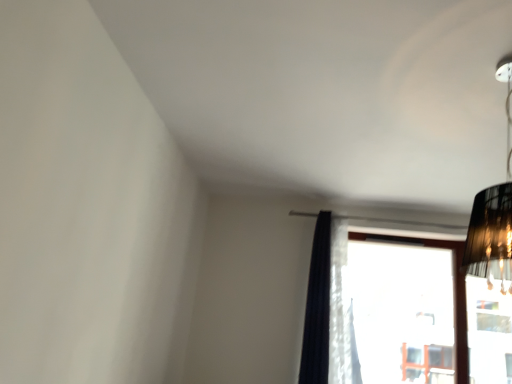
Question: In terms of width, does black fabric lampshade at upper right look wider or thinner when compared to transparent glass window at center?

Choices:
 (A) wide
 (B) thin

Answer: (A)

Question: From a real-world perspective, is black fabric lampshade at upper right above or below transparent glass window at center?

Choices:
 (A) above
 (B) below

Answer: (A)

Question: Which is nearer to the black fabric lampshade at upper right?

Choices:
 (A) transparent glass window at center
 (B) dark blue sheer curtain at center

Answer: (B)

Question: Which object is the closest to the transparent glass window at center?

Choices:
 (A) dark blue sheer curtain at center
 (B) black fabric lampshade at upper right

Answer: (A)